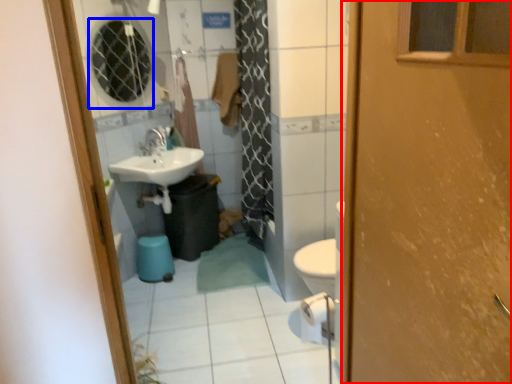
Question: Which of the following is the closest to the observer, door (highlighted by a red box) or mirror (highlighted by a blue box)?

Choices:
 (A) door
 (B) mirror

Answer: (A)